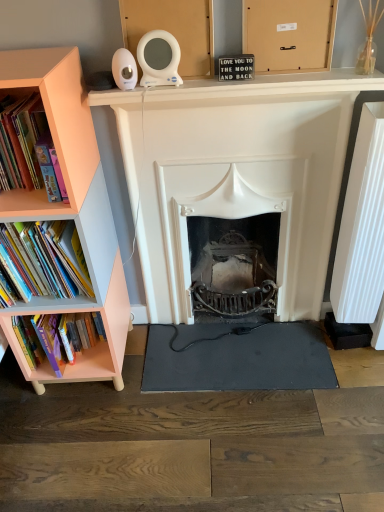
This screenshot has width=384, height=512. What do you see at coordinates (240, 166) in the screenshot?
I see `white matte fireplace at center` at bounding box center [240, 166].

I want to click on peach wood bookshelf at left, so click(x=88, y=349).

At what (x,y) coordinates should I click in order to perform the action: click on matte cardboard box at upper center. Please return your answer as a coordinate pair (x, y). This screenshot has height=512, width=384. Looking at the image, I should click on (289, 33).

Measure the distance between point (26,293) and camera.

Point (26,293) is 4.49 feet away from camera.

Locate an element on the screen. The width and height of the screenshot is (384, 512). white matte fireplace at center is located at coordinates (240, 166).

From a real-world perspective, is pink matte bookshelf at left on top of peach wood bookcase at left?

Correct, in the physical world, pink matte bookshelf at left is higher than peach wood bookcase at left.

Is pink matte bookshelf at left not within peach wood bookcase at left?

Actually, pink matte bookshelf at left is at least partially inside peach wood bookcase at left.

Which is more to the left, pink matte bookshelf at left or peach wood bookcase at left?

From the viewer's perspective, pink matte bookshelf at left appears more on the left side.

Find the location of a particular element. Image resolution: width=384 pixels, height=512 pixels. bookcase located on the right of pink matte bookshelf at left is located at coordinates (70, 212).

Does point (280, 166) come behind point (102, 351)?

No, (280, 166) is closer to viewer.

Could you tell me if white matte fireplace at center is facing peach wood bookshelf at left?

No, white matte fireplace at center is not turned towards peach wood bookshelf at left.

Consider the image. From a real-world perspective, is white matte fireplace at center located beneath peach wood bookshelf at left?

No, from a real-world perspective, white matte fireplace at center is not beneath peach wood bookshelf at left.

How far apart are white matte fireplace at center and peach wood bookshelf at left?

The distance of white matte fireplace at center from peach wood bookshelf at left is 50.67 centimeters.

Which object is positioned more to the left, hardcover books at left or matte cardboard box at upper center?

From the viewer's perspective, hardcover books at left appears more on the left side.

Is hardcover books at left in front of matte cardboard box at upper center?

No.

Which is behind, point (19, 253) or point (302, 28)?

The point (19, 253) is behind.

Considering the positions of objects black rubber yoga mat at center and matte cardboard box at upper center in the image provided, who is in front, black rubber yoga mat at center or matte cardboard box at upper center?

matte cardboard box at upper center is more forward.

From the image's perspective, which object appears higher, black rubber yoga mat at center or matte cardboard box at upper center?

From the image's view, matte cardboard box at upper center is above.

From the picture: Is black rubber yoga mat at center positioned far away from matte cardboard box at upper center?

That's right, there is a large distance between black rubber yoga mat at center and matte cardboard box at upper center.

Which of these two, black rubber yoga mat at center or matte cardboard box at upper center, is smaller?

matte cardboard box at upper center is smaller.

Is white matte fireplace at center to the right of black rubber yoga mat at center from the viewer's perspective?

Incorrect, white matte fireplace at center is not on the right side of black rubber yoga mat at center.

Is black rubber yoga mat at center surrounded by white matte fireplace at center?

No, white matte fireplace at center does not contain black rubber yoga mat at center.

From the image's perspective, is white matte fireplace at center positioned above or below black rubber yoga mat at center?

Based on their image positions, white matte fireplace at center is located above black rubber yoga mat at center.

Is white matte fireplace at center facing towards black rubber yoga mat at center?

Yes, white matte fireplace at center is facing black rubber yoga mat at center.

Considering the sizes of objects matte cardboard box at upper center and black rubber yoga mat at center in the image provided, who is bigger, matte cardboard box at upper center or black rubber yoga mat at center?

Bigger between the two is black rubber yoga mat at center.

Does matte cardboard box at upper center appear on the left side of black rubber yoga mat at center?

In fact, matte cardboard box at upper center is to the right of black rubber yoga mat at center.

Is point (282, 26) positioned after point (284, 380)?

That is False.

From the image's perspective, which object appears higher, matte cardboard box at upper center or black rubber yoga mat at center?

matte cardboard box at upper center.

Is pink matte bookshelf at left located within peach wood bookcase at left?

Absolutely, pink matte bookshelf at left is inside peach wood bookcase at left.

From a real-world perspective, does peach wood bookcase at left stand above pink matte bookshelf at left?

No, from a real-world perspective, peach wood bookcase at left is not over pink matte bookshelf at left

Is peach wood bookcase at left turned away from pink matte bookshelf at left?

Correct, peach wood bookcase at left is looking away from pink matte bookshelf at left.

How different are the orientations of peach wood bookcase at left and pink matte bookshelf at left in degrees?

The angle between the facing direction of peach wood bookcase at left and the facing direction of pink matte bookshelf at left is 0.767 degrees.

The image size is (384, 512). What are the coordinates of `shelf behind the peach wood bookcase at left` in the screenshot? It's located at (53, 126).

This screenshot has width=384, height=512. Find the location of `cabinet that is under the white matte fireplace at center (from a real-world perspective)`. cabinet that is under the white matte fireplace at center (from a real-world perspective) is located at coordinates (88, 349).

Considering their positions, is peach wood bookcase at left positioned closer to black rubber yoga mat at center than white matte fireplace at center?

white matte fireplace at center.

Looking at the image, which one is located closer to hardcover books at left, matte cardboard box at upper center or peach wood bookcase at left?

The object closer to hardcover books at left is peach wood bookcase at left.

Based on their spatial positions, is black rubber yoga mat at center or matte cardboard box at upper center further from white matte fireplace at center?

The object further to white matte fireplace at center is black rubber yoga mat at center.

From the image, which object appears to be farther from pink matte bookshelf at left, black rubber yoga mat at center or hardcover books at left?

Among the two, black rubber yoga mat at center is located further to pink matte bookshelf at left.

Which object lies further to the anchor point peach wood bookshelf at left, black rubber yoga mat at center or hardcover books at left?

Among the two, black rubber yoga mat at center is located further to peach wood bookshelf at left.

When comparing their distances from peach wood bookshelf at left, does pink matte bookshelf at left or hardcover books at left seem closer?

Based on the image, hardcover books at left appears to be nearer to peach wood bookshelf at left.

From the image, which object appears to be farther from peach wood bookcase at left, matte cardboard box at upper center or hardcover books at left?

Among the two, matte cardboard box at upper center is located further to peach wood bookcase at left.

Consider the image. Considering their positions, is white matte fireplace at center positioned closer to black rubber yoga mat at center than peach wood bookshelf at left?

peach wood bookshelf at left.

Find the location of a particular element. This screenshot has width=384, height=512. fireplace between peach wood bookcase at left and black rubber yoga mat at center is located at coordinates (240, 166).

The height and width of the screenshot is (512, 384). I want to click on bookcase between matte cardboard box at upper center and black rubber yoga mat at center in the vertical direction, so click(x=70, y=212).

I want to click on fireplace between pink matte bookshelf at left and matte cardboard box at upper center from left to right, so click(x=240, y=166).

Identify the location of book between matte cardboard box at upper center and black rubber yoga mat at center in the up-down direction. (44, 260).